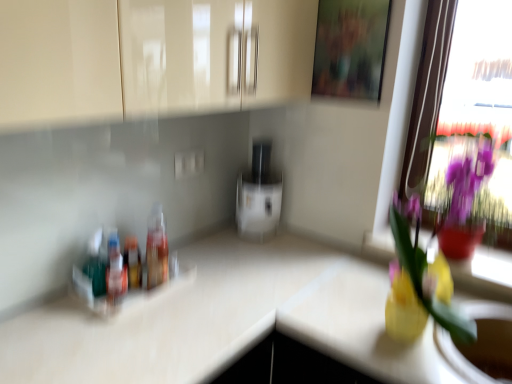
Describe the element at coordinates (463, 108) in the screenshot. I see `transparent glass window at upper right` at that location.

This screenshot has height=384, width=512. What do you see at coordinates (150, 58) in the screenshot?
I see `glossy beige cabinet at upper center` at bounding box center [150, 58].

Image resolution: width=512 pixels, height=384 pixels. Describe the element at coordinates (259, 195) in the screenshot. I see `white glossy toaster at center` at that location.

What do you see at coordinates (156, 248) in the screenshot? The image size is (512, 384). I see `translucent plastic bottle at center, positioned as the first bottle in right-to-left order` at bounding box center [156, 248].

The height and width of the screenshot is (384, 512). Identify the location of translucent plastic bottle at center, positioned as the first bottle in right-to-left order. (156, 248).

Measure the distance between point (403, 320) and camera.

1.18 meters.

Where is `white glossy countertop at center`? white glossy countertop at center is located at coordinates [227, 321].

Which object is positioned more to the left, white glossy countertop at center or transparent glass window at upper right?

white glossy countertop at center is more to the left.

How different are the orientations of white glossy countertop at center and transparent glass window at upper right in degrees?

white glossy countertop at center and transparent glass window at upper right are facing 87.4 degrees away from each other.

This screenshot has width=512, height=384. Find the location of `countertop that is in front of the transparent glass window at upper right`. countertop that is in front of the transparent glass window at upper right is located at coordinates (227, 321).

Does yellow glass vase at upper right appear on the left side of transparent glass window at upper right?

No.

Which of these two, yellow glass vase at upper right or transparent glass window at upper right, is bigger?

Bigger between the two is transparent glass window at upper right.

From the picture: Who is more distant, yellow glass vase at upper right or transparent glass window at upper right?

yellow glass vase at upper right is behind.

From the image's perspective, which one is positioned lower, yellow glass vase at upper right or transparent glass window at upper right?

yellow glass vase at upper right, from the image's perspective.

From the image's perspective, is translucent plastic bottles at left, the first bottle when ordered from left to right, located beneath wooden frame at upper center?

Yes.

Can you tell me how much translucent plastic bottles at left, acting as the third bottle starting from the right, and wooden frame at upper center differ in facing direction?

They differ by 90.5 degrees in their facing directions.

In the scene shown: From a real-world perspective, is translucent plastic bottles at left, the first bottle when ordered from left to right, above or below wooden frame at upper center?

From a real-world perspective, translucent plastic bottles at left, the first bottle when ordered from left to right, is physically below wooden frame at upper center.

Who is smaller, yellow glass vase at right or wooden frame at upper center?

Smaller between the two is wooden frame at upper center.

Is yellow glass vase at right looking in the opposite direction of wooden frame at upper center?

That's not correct — yellow glass vase at right is not looking away from wooden frame at upper center.

Is yellow glass vase at right inside or outside of wooden frame at upper center?

yellow glass vase at right exists outside the volume of wooden frame at upper center.

Is the surface of yellow glass vase at right in direct contact with transparent glass window at upper right?

No, yellow glass vase at right is not beside transparent glass window at upper right.

Does yellow glass vase at right have a smaller size compared to transparent glass window at upper right?

Indeed, yellow glass vase at right has a smaller size compared to transparent glass window at upper right.

Does point (419, 327) come farther from viewer compared to point (435, 45)?

No.

Is translucent plastic bottle at center, the third bottle when ordered from left to right, not close to glossy beige cabinet at upper center?

No, translucent plastic bottle at center, the third bottle when ordered from left to right, is in close proximity to glossy beige cabinet at upper center.

From the picture: Can you confirm if translucent plastic bottle at center, positioned as the first bottle in right-to-left order, is taller than glossy beige cabinet at upper center?

No.

Which point is more forward, (154,241) or (234,93)?

The point (234,93) is closer to the camera.

Looking at their sizes, would you say translucent plastic bottle at center, the third bottle when ordered from left to right, is wider or thinner than glossy beige cabinet at upper center?

Clearly, translucent plastic bottle at center, the third bottle when ordered from left to right, has less width compared to glossy beige cabinet at upper center.

Measure the distance between translucent plastic bottle at center, positioned as the first bottle in right-to-left order, and wooden frame at upper center.

The distance of translucent plastic bottle at center, positioned as the first bottle in right-to-left order, from wooden frame at upper center is 36.16 inches.

Do you think translucent plastic bottle at center, the third bottle when ordered from left to right, is within wooden frame at upper center, or outside of it?

translucent plastic bottle at center, the third bottle when ordered from left to right, is outside wooden frame at upper center.

Can you confirm if translucent plastic bottle at center, positioned as the first bottle in right-to-left order, is shorter than wooden frame at upper center?

Yes, translucent plastic bottle at center, positioned as the first bottle in right-to-left order, is shorter than wooden frame at upper center.

Is translucent plastic bottle at center, the third bottle when ordered from left to right, bigger or smaller than wooden frame at upper center?

translucent plastic bottle at center, the third bottle when ordered from left to right, is smaller than wooden frame at upper center.

Locate an element on the screen. The height and width of the screenshot is (384, 512). countertop located on the left of transparent glass window at upper right is located at coordinates (227, 321).

In the image, there is a transparent glass window at upper right. Where is `window sill below it (from a real-world perspective)`? window sill below it (from a real-world perspective) is located at coordinates (486, 270).

From the image, which object appears to be farther from translucent plastic bottles at left, acting as the third bottle starting from the right, white glossy toaster at center or yellow glass vase at right?

Based on the image, yellow glass vase at right appears to be further to translucent plastic bottles at left, acting as the third bottle starting from the right.

Estimate the real-world distances between objects in this image. Which object is further from white glossy countertop at center, translucent plastic bottles at left, the first bottle when ordered from left to right, or yellow glass vase at upper right?

Based on the image, yellow glass vase at upper right appears to be further to white glossy countertop at center.

When comparing their distances from yellow glass vase at upper right, does translucent plastic bottles at left, acting as the 2th bottle starting from the left, or white glossy countertop at center seem closer?

white glossy countertop at center is positioned closer to the anchor yellow glass vase at upper right.

When comparing their distances from translucent plastic bottles at left, acting as the third bottle starting from the right, does wooden frame at upper center or transparent glass window at upper right seem further?

transparent glass window at upper right is further to translucent plastic bottles at left, acting as the third bottle starting from the right.

Estimate the real-world distances between objects in this image. Which object is further from glossy beige cabinet at upper center, translucent plastic bottle at center, positioned as the first bottle in right-to-left order, or white glossy countertop at center?

A: Among the two, white glossy countertop at center is located further to glossy beige cabinet at upper center.

When comparing their distances from translucent plastic bottles at left, acting as the third bottle starting from the right, does translucent plastic bottle at center, the third bottle when ordered from left to right, or transparent glass window at upper right seem further?

transparent glass window at upper right lies further to translucent plastic bottles at left, acting as the third bottle starting from the right, than the other object.

Looking at the image, which one is located closer to translucent plastic bottles at left, acting as the third bottle starting from the right, glossy beige cabinet at upper center or wooden frame at upper center?

glossy beige cabinet at upper center is positioned closer to the anchor translucent plastic bottles at left, acting as the third bottle starting from the right.

Based on their spatial positions, is glossy beige cabinet at upper center or white glossy countertop at center further from yellow glass vase at upper right?

Among the two, glossy beige cabinet at upper center is located further to yellow glass vase at upper right.

At what (x,y) coordinates should I click in order to perform the action: click on appliance that lies between wooden frame at upper center and translucent plastic bottles at left, the first bottle when ordered from left to right, from top to bottom. Please return your answer as a coordinate pair (x, y). Looking at the image, I should click on (259, 195).

You are a GUI agent. You are given a task and a screenshot of the screen. Output one action in this format:
    pyautogui.click(x=<x>, y=<y>)
    Task: Click on the floral arrangement between translucent plastic bottles at left, the first bottle when ordered from left to right, and yellow glass vase at upper right from left to right
    
    Given the screenshot: What is the action you would take?
    pyautogui.click(x=419, y=283)

This screenshot has height=384, width=512. Find the location of `window positioned between yellow glass vase at right and white glossy toaster at center from near to far`. window positioned between yellow glass vase at right and white glossy toaster at center from near to far is located at coordinates (463, 108).

The image size is (512, 384). I want to click on window between translucent plastic bottles at left, the first bottle when ordered from left to right, and yellow glass vase at upper right, so pos(463,108).